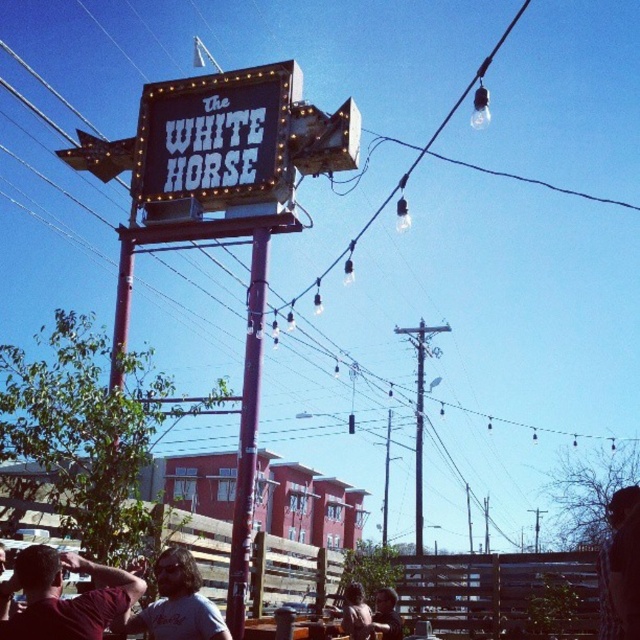
You are a photographer trying to capture the scene of the maroon shirt at lower left and the brown leather jacket at lower center. Which person should you focus on first if you want to include both in your shot without moving the camera?

The maroon shirt at lower left has a greater width than the brown leather jacket at lower center, so focusing on the maroon shirt at lower left first would allow you to frame both subjects effectively without needing to adjust the camera position.

You are a photographer standing in the scene. You want to take a photo of the maroon shirt at lower left and the brown leather jacket at lower center. Which person should you focus on first if you want to capture both in the same frame without moving the camera?

The maroon shirt at lower left is positioned over the brown leather jacket at lower center, so focusing on the maroon shirt at lower left first will ensure both are in the frame as the brown leather jacket at lower center is below it.